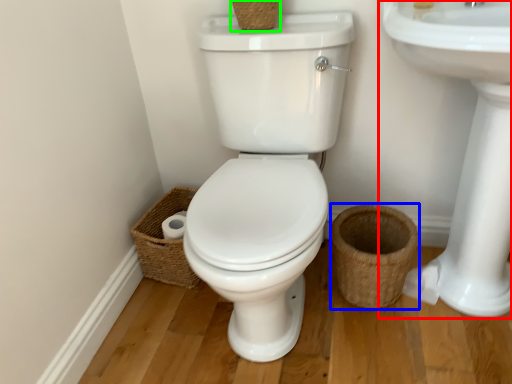
Question: Which object is positioned closest to sink (highlighted by a red box)? Select from basket (highlighted by a blue box) and basket (highlighted by a green box).

Choices:
 (A) basket
 (B) basket

Answer: (A)